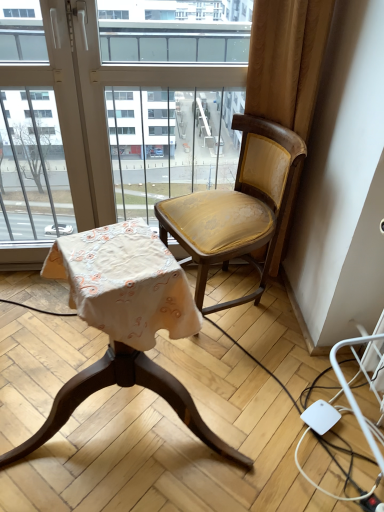
Question: Are matte gold fabric chair at center, placed as the 1th chair when sorted from left to right, and transparent glass window at upper center making contact?

Choices:
 (A) no
 (B) yes

Answer: (A)

Question: Can you confirm if matte gold fabric chair at center, the 2th chair when ordered from right to left, is wider than transparent glass window at upper center?

Choices:
 (A) yes
 (B) no

Answer: (A)

Question: Is matte gold fabric chair at center, placed as the 1th chair when sorted from left to right, positioned in front of transparent glass window at upper center?

Choices:
 (A) yes
 (B) no

Answer: (A)

Question: Is matte gold fabric chair at center, placed as the 1th chair when sorted from left to right, far from transparent glass window at upper center?

Choices:
 (A) yes
 (B) no

Answer: (B)

Question: Is matte gold fabric chair at center, the 2th chair when ordered from right to left, not inside transparent glass window at upper center?

Choices:
 (A) yes
 (B) no

Answer: (A)

Question: Considering the positions of transparent glass window at upper center and matte gold fabric chair at right, which is the 1th chair in right-to-left order, in the image, is transparent glass window at upper center taller or shorter than matte gold fabric chair at right, which is the 1th chair in right-to-left order,?

Choices:
 (A) tall
 (B) short

Answer: (A)

Question: From a real-world perspective, is transparent glass window at upper center physically located above or below matte gold fabric chair at right, the second chair when ordered from left to right?

Choices:
 (A) below
 (B) above

Answer: (B)

Question: Considering their positions, is transparent glass window at upper center located in front of or behind matte gold fabric chair at right, the second chair when ordered from left to right?

Choices:
 (A) behind
 (B) front

Answer: (A)

Question: Is point (104, 188) positioned closer to the camera than point (170, 231)?

Choices:
 (A) farther
 (B) closer

Answer: (A)

Question: Is matte gold fabric chair at center, the 2th chair when ordered from right to left, wider or thinner than matte gold fabric chair at right, which is the 1th chair in right-to-left order?

Choices:
 (A) thin
 (B) wide

Answer: (B)

Question: Is matte gold fabric chair at center, placed as the 1th chair when sorted from left to right, in front of or behind matte gold fabric chair at right, which is the 1th chair in right-to-left order, in the image?

Choices:
 (A) front
 (B) behind

Answer: (A)

Question: In terms of size, does matte gold fabric chair at center, placed as the 1th chair when sorted from left to right, appear bigger or smaller than matte gold fabric chair at right, which is the 1th chair in right-to-left order?

Choices:
 (A) big
 (B) small

Answer: (A)

Question: From a real-world perspective, relative to matte gold fabric chair at right, which is the 1th chair in right-to-left order, is matte gold fabric chair at center, placed as the 1th chair when sorted from left to right, vertically above or below?

Choices:
 (A) above
 (B) below

Answer: (B)

Question: Considering the positions of point (244, 176) and point (3, 258), is point (244, 176) closer or farther from the camera than point (3, 258)?

Choices:
 (A) closer
 (B) farther

Answer: (A)

Question: Do you think matte gold fabric chair at right, which is the 1th chair in right-to-left order, is within transparent glass window at upper center, or outside of it?

Choices:
 (A) outside
 (B) inside

Answer: (A)